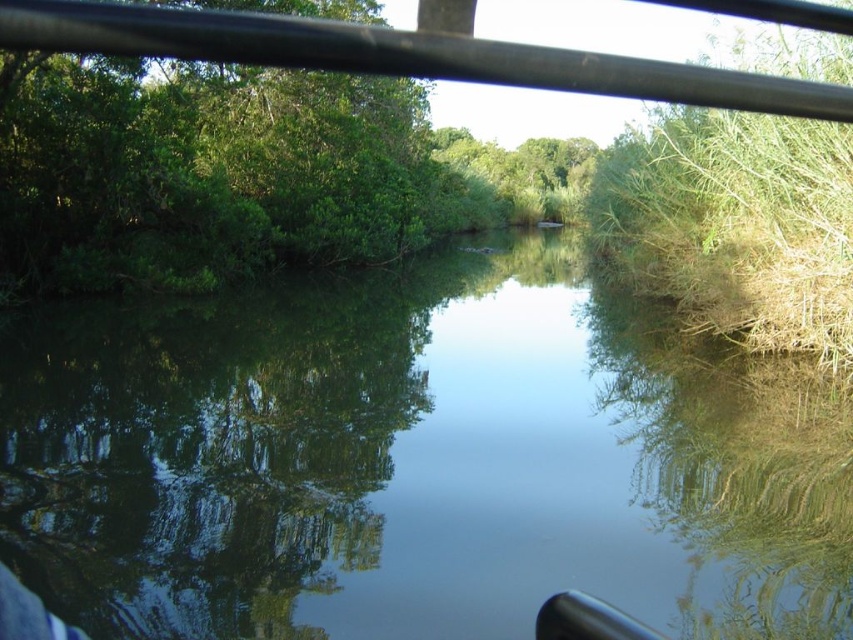
Looking at this image, between green reflective water at center and black metal rail at upper center, which one appears on the right side from the viewer's perspective?

green reflective water at center is more to the right.

Which of these two, green reflective water at center or black metal rail at upper center, stands taller?

With more height is green reflective water at center.

At what (x,y) coordinates should I click in order to perform the action: click on green reflective water at center. Please return your answer as a coordinate pair (x, y). The image size is (853, 640). Looking at the image, I should click on (416, 461).

Identify the location of green reflective water at center. The height and width of the screenshot is (640, 853). (416, 461).